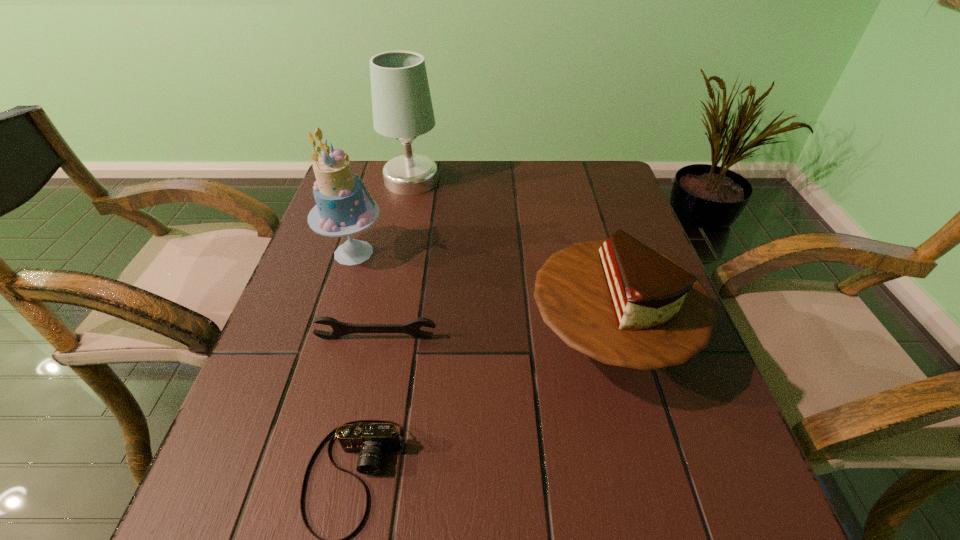
I want to click on vacant space at the near left corner of the desktop, so click(185, 532).

Locate an element on the screen. The height and width of the screenshot is (540, 960). free space at the far right corner of the desktop is located at coordinates tap(568, 161).

Where is `blank region between the left cake and the shorter cake`? The image size is (960, 540). blank region between the left cake and the shorter cake is located at coordinates (481, 295).

Locate an element on the screen. vacant space in between the farthest object and the wrench is located at coordinates (394, 259).

Locate an element on the screen. The height and width of the screenshot is (540, 960). vacant space in between the wrench and the left cake is located at coordinates (365, 295).

You are a GUI agent. You are given a task and a screenshot of the screen. Output one action in this format:
    pyautogui.click(x=<x>, y=<y>)
    Task: Click on the free space between the left cake and the wrench
    
    Given the screenshot: What is the action you would take?
    pyautogui.click(x=365, y=295)

Find the location of a particular element. The image size is (960, 540). empty location between the taller cake and the right cake is located at coordinates (481, 295).

Locate an element on the screen. This screenshot has width=960, height=540. free point between the wrench and the lampshade is located at coordinates (394, 259).

Find the location of `free space between the lampshade and the left cake`. free space between the lampshade and the left cake is located at coordinates (383, 217).

Identify which object is the nearest to the taller cake. Please provide its 2D coordinates. Your answer should be formatted as a tuple, i.e. [(x, y)], where the tuple contains the x and y coordinates of a point satisfying the conditions above.

[(402, 107)]